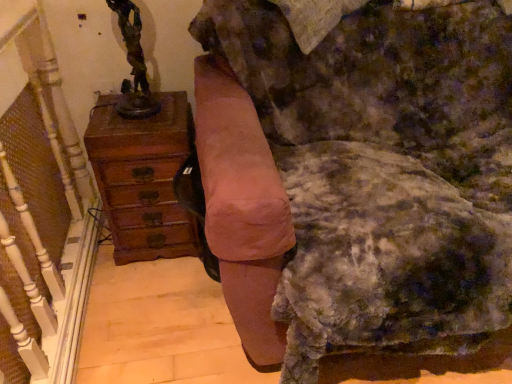
Describe the element at coordinates (385, 259) in the screenshot. This screenshot has width=512, height=384. I see `suede-like pink swivel chair at center` at that location.

The width and height of the screenshot is (512, 384). Find the location of `bronze statue at upper left`. bronze statue at upper left is located at coordinates (133, 65).

Considering the sizes of velvet pink armchair at center and suede-like pink swivel chair at center in the image, is velvet pink armchair at center wider or thinner than suede-like pink swivel chair at center?

velvet pink armchair at center is wider than suede-like pink swivel chair at center.

Is velvet pink armchair at center oriented towards suede-like pink swivel chair at center?

No, velvet pink armchair at center is not turned towards suede-like pink swivel chair at center.

From the image's perspective, is wooden chest of drawers at left on velvet pink armchair at center?

Actually, wooden chest of drawers at left appears below velvet pink armchair at center in the image.

Does point (177, 149) appear closer or farther from the camera than point (501, 85)?

Point (177, 149) appears to be closer to the viewer than point (501, 85).

Is wooden chest of drawers at left not within velvet pink armchair at center?

Absolutely, wooden chest of drawers at left is external to velvet pink armchair at center.

Is wooden chest of drawers at left shorter than velvet pink armchair at center?

Yes.

From the image's perspective, which one is positioned higher, bronze statue at upper left or velvet pink armchair at center?

bronze statue at upper left is shown above in the image.

Which of these two, bronze statue at upper left or velvet pink armchair at center, is wider?

With larger width is velvet pink armchair at center.

Is bronze statue at upper left oriented away from velvet pink armchair at center?

bronze statue at upper left is not turned away from velvet pink armchair at center.

From a real-world perspective, is bronze statue at upper left on velvet pink armchair at center?

Yes, from a real-world perspective, bronze statue at upper left is above velvet pink armchair at center.

Can you confirm if wooden chest of drawers at left is thinner than bronze statue at upper left?

In fact, wooden chest of drawers at left might be wider than bronze statue at upper left.

Does point (106, 162) come closer to viewer compared to point (135, 44)?

Yes.

Is wooden chest of drawers at left situated inside bronze statue at upper left or outside?

wooden chest of drawers at left exists outside the volume of bronze statue at upper left.

Considering the sizes of wooden chest of drawers at left and bronze statue at upper left in the image, is wooden chest of drawers at left taller or shorter than bronze statue at upper left?

Clearly, wooden chest of drawers at left is taller compared to bronze statue at upper left.

Does velvet pink armchair at center turn towards wooden chest of drawers at left?

No, velvet pink armchair at center is not facing towards wooden chest of drawers at left.

Is the depth of velvet pink armchair at center less than that of wooden chest of drawers at left?

Yes, velvet pink armchair at center is closer to the camera.

Who is bigger, velvet pink armchair at center or wooden chest of drawers at left?

velvet pink armchair at center.

Considering the relative sizes of velvet pink armchair at center and wooden chest of drawers at left in the image provided, is velvet pink armchair at center shorter than wooden chest of drawers at left?

No.

From a real-world perspective, is bronze statue at upper left above or below wooden chest of drawers at left?

bronze statue at upper left is situated higher than wooden chest of drawers at left in the real world.

Considering the relative sizes of bronze statue at upper left and wooden chest of drawers at left in the image provided, is bronze statue at upper left wider than wooden chest of drawers at left?

No, bronze statue at upper left is not wider than wooden chest of drawers at left.

Considering the relative sizes of bronze statue at upper left and wooden chest of drawers at left in the image provided, is bronze statue at upper left smaller than wooden chest of drawers at left?

Yes, bronze statue at upper left is smaller than wooden chest of drawers at left.

From the image's perspective, is wooden chest of drawers at left beneath suede-like pink swivel chair at center?

No, from the image's perspective, wooden chest of drawers at left is not beneath suede-like pink swivel chair at center.

Considering the sizes of objects wooden chest of drawers at left and suede-like pink swivel chair at center in the image provided, who is wider, wooden chest of drawers at left or suede-like pink swivel chair at center?

Wider between the two is suede-like pink swivel chair at center.

Who is smaller, wooden chest of drawers at left or suede-like pink swivel chair at center?

With smaller size is wooden chest of drawers at left.

Find the location of a particular element. This screenshot has width=512, height=384. furniture on the right side of suede-like pink swivel chair at center is located at coordinates (384, 171).

Find the location of a particular element. the chest of drawers located underneath the velvet pink armchair at center (from a real-world perspective) is located at coordinates pyautogui.click(x=143, y=177).

Which object lies nearer to the anchor point bronze statue at upper left, suede-like pink swivel chair at center or velvet pink armchair at center?

velvet pink armchair at center.

Looking at the image, which one is located closer to wooden chest of drawers at left, bronze statue at upper left or suede-like pink swivel chair at center?

bronze statue at upper left is closer to wooden chest of drawers at left.

Considering their positions, is wooden chest of drawers at left positioned closer to velvet pink armchair at center than suede-like pink swivel chair at center?

suede-like pink swivel chair at center lies closer to velvet pink armchair at center than the other object.

When comparing their distances from suede-like pink swivel chair at center, does bronze statue at upper left or velvet pink armchair at center seem closer?

velvet pink armchair at center is positioned closer to the anchor suede-like pink swivel chair at center.

Considering their positions, is suede-like pink swivel chair at center positioned closer to velvet pink armchair at center than bronze statue at upper left?

suede-like pink swivel chair at center.

From the image, which object appears to be nearer to wooden chest of drawers at left, bronze statue at upper left or velvet pink armchair at center?

bronze statue at upper left lies closer to wooden chest of drawers at left than the other object.

Looking at the image, which one is located closer to bronze statue at upper left, wooden chest of drawers at left or velvet pink armchair at center?

The object closer to bronze statue at upper left is wooden chest of drawers at left.

When comparing their distances from suede-like pink swivel chair at center, does velvet pink armchair at center or bronze statue at upper left seem further?

bronze statue at upper left lies further to suede-like pink swivel chair at center than the other object.

The image size is (512, 384). Find the location of `swivel chair between bronze statue at upper left and velvet pink armchair at center in the horizontal direction`. swivel chair between bronze statue at upper left and velvet pink armchair at center in the horizontal direction is located at coordinates (385, 259).

The width and height of the screenshot is (512, 384). In order to click on swivel chair between wooden chest of drawers at left and velvet pink armchair at center in the horizontal direction in this screenshot , I will do `click(385, 259)`.

Locate an element on the screen. This screenshot has width=512, height=384. chest of drawers between bronze statue at upper left and velvet pink armchair at center is located at coordinates (143, 177).

The image size is (512, 384). What are the coordinates of `the chest of drawers that lies between bronze statue at upper left and suede-like pink swivel chair at center from top to bottom` in the screenshot? It's located at (143, 177).